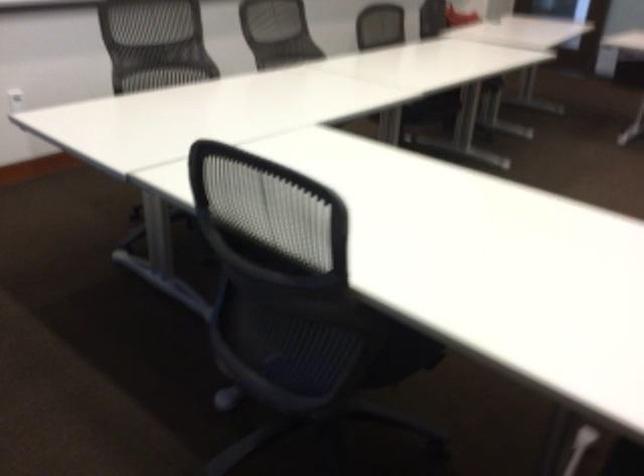
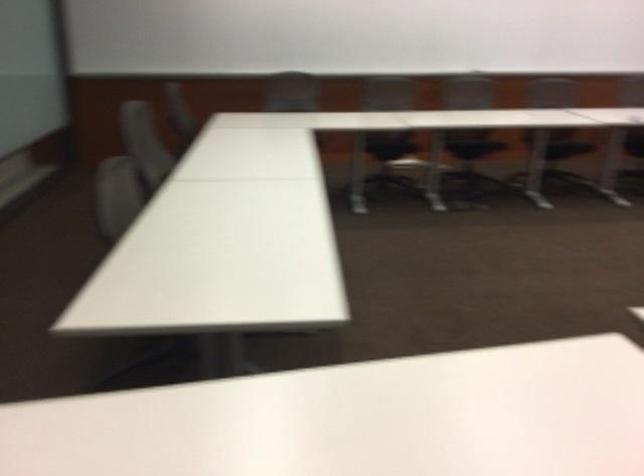
Question: The images are taken continuously from a first-person perspective. In which direction are you moving?

Choices:
 (A) Left
 (B) Right
 (C) Forward
 (D) Backward

Answer: (D)